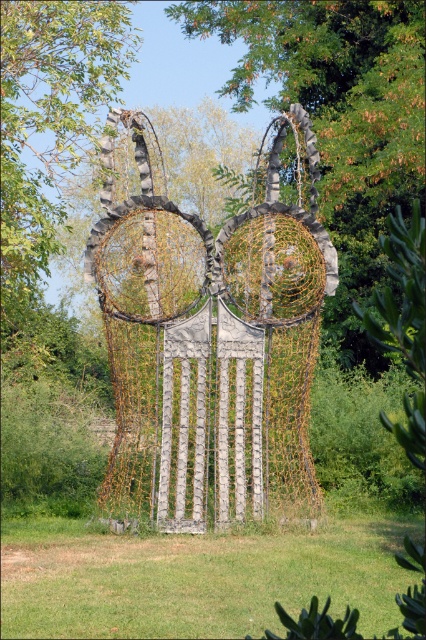
Which of these two, rusty wire mesh sculpture at center or green leafy tree at center, stands taller?

With more height is green leafy tree at center.

Is point (304, 216) farther from viewer compared to point (403, 88)?

That is False.

Where is `rusty wire mesh sculpture at center`? This screenshot has width=426, height=640. rusty wire mesh sculpture at center is located at coordinates (209, 340).

Is green leafy tree at center taller than green leafy tree at upper center?

Indeed, green leafy tree at center has a greater height compared to green leafy tree at upper center.

Who is positioned more to the right, green leafy tree at center or green leafy tree at upper center?

green leafy tree at center

Is point (359, 28) positioned in front of point (77, 90)?

No, (359, 28) is behind (77, 90).

Where is `green leafy tree at center`? This screenshot has height=640, width=426. green leafy tree at center is located at coordinates (339, 118).

What do you see at coordinates (209, 340) in the screenshot? The height and width of the screenshot is (640, 426). I see `rusty wire mesh sculpture at center` at bounding box center [209, 340].

Can you confirm if rusty wire mesh sculpture at center is wider than green leafy tree at upper center?

Incorrect, rusty wire mesh sculpture at center's width does not surpass green leafy tree at upper center's.

Locate an element on the screen. This screenshot has height=640, width=426. rusty wire mesh sculpture at center is located at coordinates [209, 340].